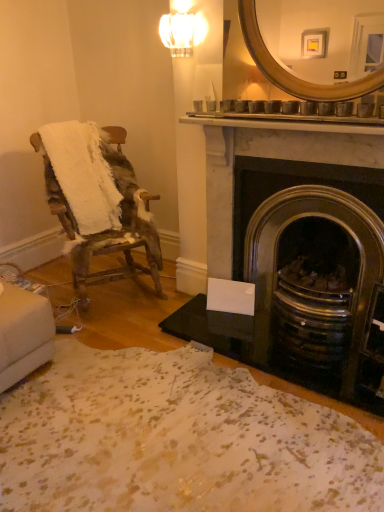
Question: Is gold metallic mirror at upper center inside or outside of dark gray stone fireplace at center right?

Choices:
 (A) inside
 (B) outside

Answer: (B)

Question: Looking at the image, does gold metallic mirror at upper center seem bigger or smaller compared to dark gray stone fireplace at center right?

Choices:
 (A) big
 (B) small

Answer: (B)

Question: Estimate the real-world distances between objects in this image. Which object is farther from the gold metallic mirror at upper center?

Choices:
 (A) worn wood chair at left
 (B) dark gray stone fireplace at center right
 (C) clear glass sconce at upper center

Answer: (A)

Question: Which object is positioned farthest from the worn wood chair at left?

Choices:
 (A) dark gray stone fireplace at center right
 (B) gold metallic mirror at upper center
 (C) clear glass sconce at upper center

Answer: (B)